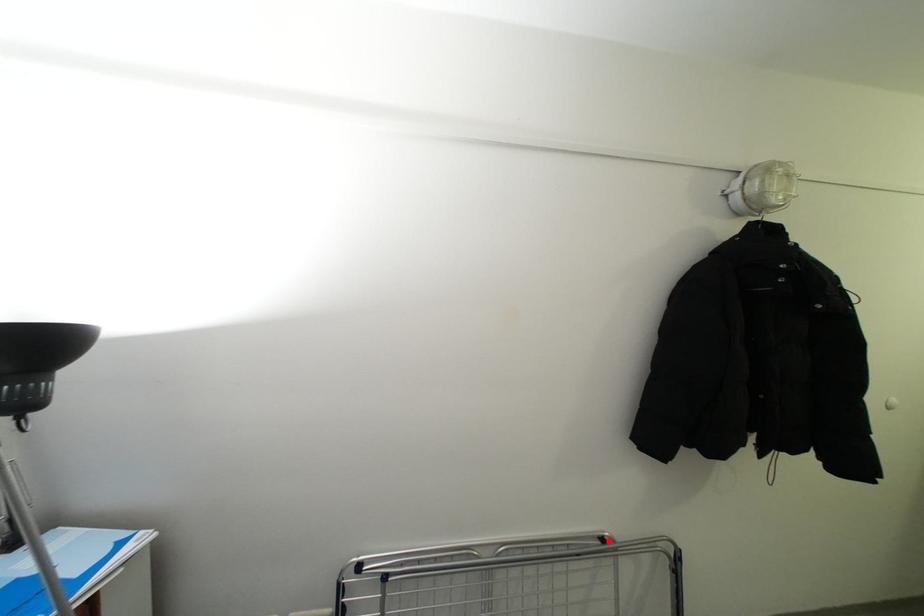
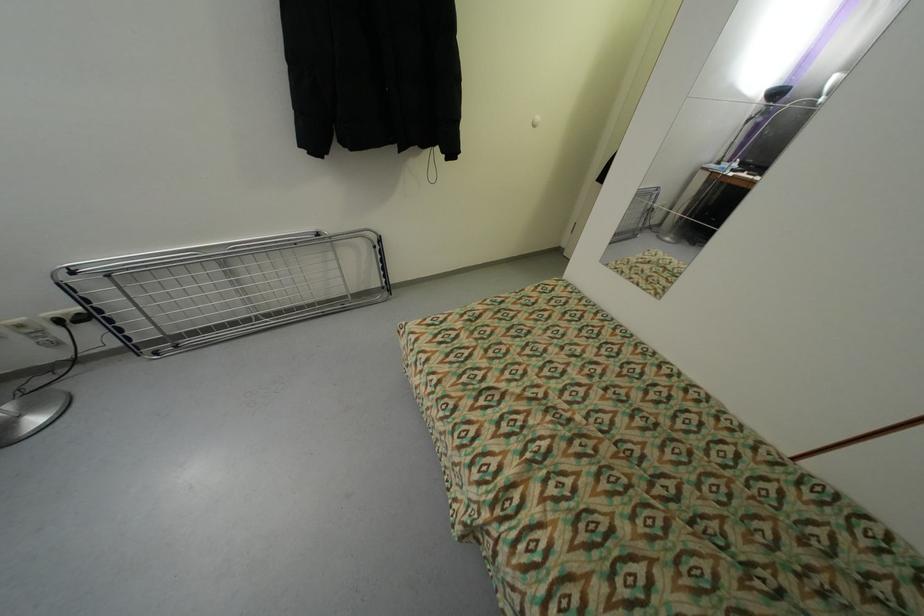
The point at the highlighted location is marked in the first image. Where is the corresponding point in the second image?

(323, 236)